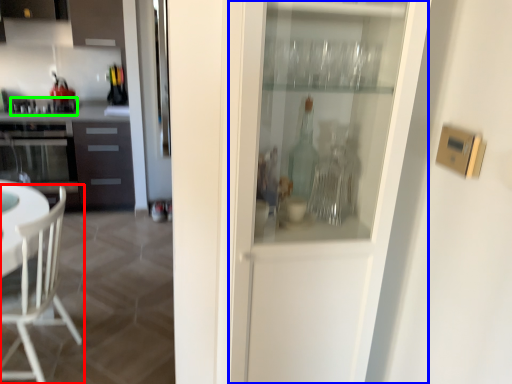
Question: Which object is the closest to the chair (highlighted by a red box)? Choose among these: screen door (highlighted by a blue box) or appliance (highlighted by a green box).

Choices:
 (A) screen door
 (B) appliance

Answer: (A)